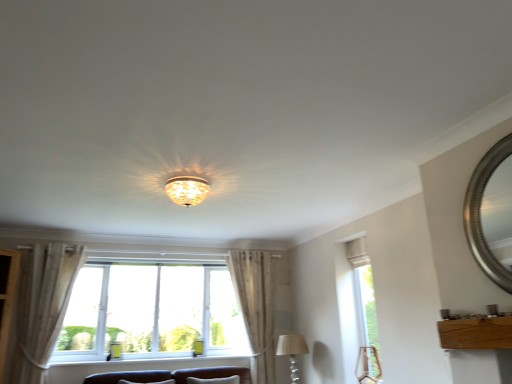
Question: Can you confirm if wooden board at lower right is positioned to the right of clear glass window at right, which is the 2th window in left-to-right order?

Choices:
 (A) no
 (B) yes

Answer: (B)

Question: Is wooden board at lower right located outside clear glass window at right, which ranks as the 1th window in right-to-left order?

Choices:
 (A) yes
 (B) no

Answer: (A)

Question: From the image's perspective, is wooden board at lower right below clear glass window at right, which ranks as the 1th window in right-to-left order?

Choices:
 (A) yes
 (B) no

Answer: (B)

Question: Is the surface of wooden board at lower right in direct contact with clear glass window at right, which ranks as the 1th window in right-to-left order?

Choices:
 (A) yes
 (B) no

Answer: (B)

Question: Does wooden board at lower right come behind clear glass window at right, which ranks as the 1th window in right-to-left order?

Choices:
 (A) no
 (B) yes

Answer: (A)

Question: Can clear glass window at right, which ranks as the 1th window in right-to-left order, be found inside wooden board at lower right?

Choices:
 (A) yes
 (B) no

Answer: (B)

Question: From a real-world perspective, does clear glass window at right, which is the 2th window in left-to-right order, sit lower than silver metallic mirror at upper right?

Choices:
 (A) no
 (B) yes

Answer: (B)

Question: Considering the relative sizes of clear glass window at right, which is the 2th window in left-to-right order, and silver metallic mirror at upper right in the image provided, is clear glass window at right, which is the 2th window in left-to-right order, wider than silver metallic mirror at upper right?

Choices:
 (A) no
 (B) yes

Answer: (B)

Question: Is clear glass window at right, which is the 2th window in left-to-right order, to the right of silver metallic mirror at upper right from the viewer's perspective?

Choices:
 (A) no
 (B) yes

Answer: (A)

Question: Would you say clear glass window at right, which ranks as the 1th window in right-to-left order, contains silver metallic mirror at upper right?

Choices:
 (A) yes
 (B) no

Answer: (B)

Question: Are clear glass window at right, which ranks as the 1th window in right-to-left order, and silver metallic mirror at upper right making contact?

Choices:
 (A) yes
 (B) no

Answer: (B)

Question: Can you confirm if clear glass window at right, which is the 2th window in left-to-right order, is positioned to the left of silver metallic mirror at upper right?

Choices:
 (A) yes
 (B) no

Answer: (A)

Question: Is light beige fabric curtain at left, which is counted as the second curtain, starting from the right, to the left of beige fabric lampshade at lower center, the 2th lamp viewed from the front, from the viewer's perspective?

Choices:
 (A) yes
 (B) no

Answer: (A)